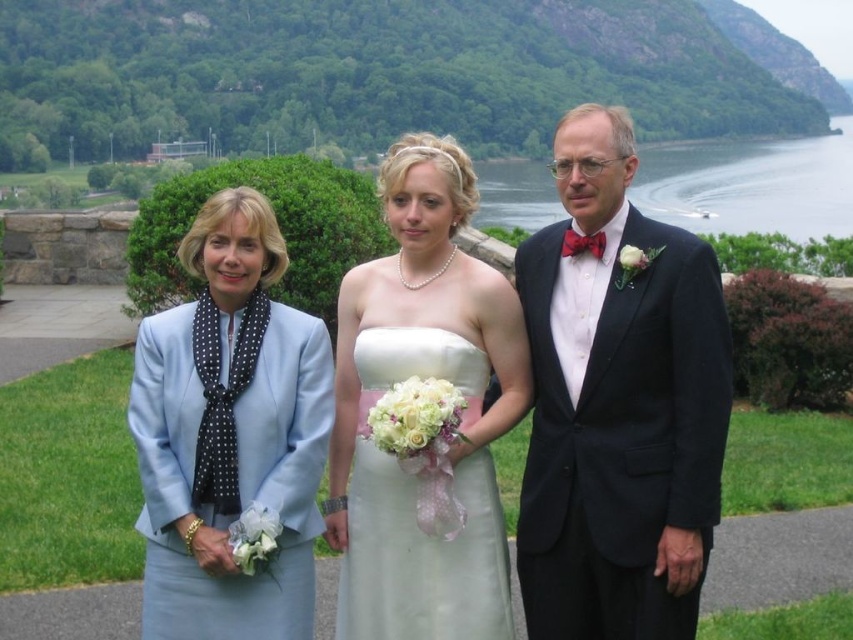
Question: Which point is closer to the camera?

Choices:
 (A) (196, 636)
 (B) (688, 589)

Answer: (B)

Question: Can you confirm if white satin dress at center is positioned to the left of clear water at right?

Choices:
 (A) no
 (B) yes

Answer: (B)

Question: Which object is farther from the camera taking this photo?

Choices:
 (A) clear water at right
 (B) matte black suit at center
 (C) light blue fabric dress at left

Answer: (A)

Question: Which object appears farthest from the camera in this image?

Choices:
 (A) matte black suit at center
 (B) white satin dress at center
 (C) clear water at right

Answer: (C)

Question: Is matte black suit at center closer to camera compared to clear water at right?

Choices:
 (A) yes
 (B) no

Answer: (A)

Question: Is light blue fabric dress at left thinner than white satin dress at center?

Choices:
 (A) no
 (B) yes

Answer: (A)